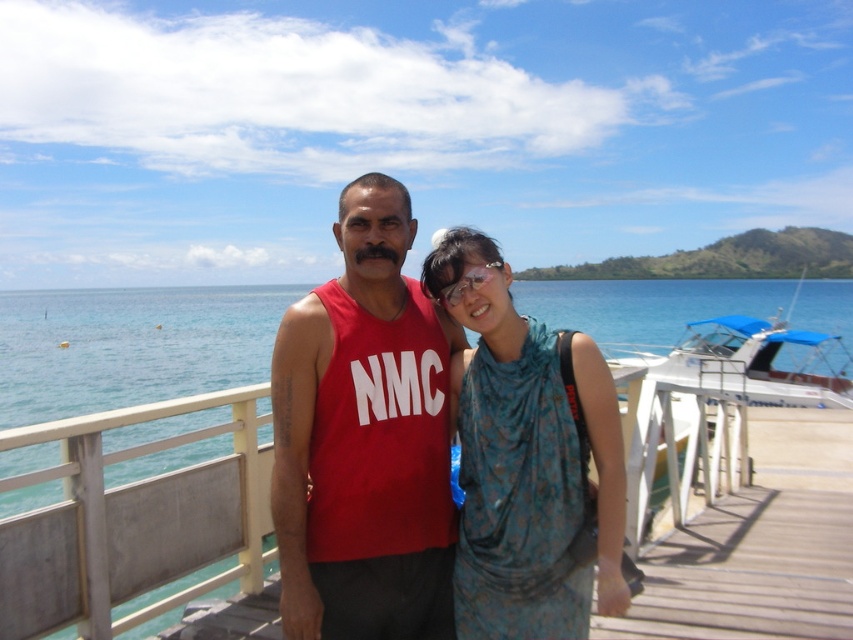
Looking at this image, who is positioned more to the left, matte red tank top at center or blue water at center?

Positioned to the left is matte red tank top at center.

Is matte red tank top at center to the right of blue water at center from the viewer's perspective?

No, matte red tank top at center is not to the right of blue water at center.

Does point (410, 221) lie behind point (107, 336)?

No, it is not.

Locate an element on the screen. This screenshot has width=853, height=640. matte red tank top at center is located at coordinates (364, 438).

Can you confirm if blue water at center is positioned above blue floral dress at center?

Yes.

Who is more forward, [752,308] or [564,589]?

Point [564,589] is in front.

Image resolution: width=853 pixels, height=640 pixels. In order to click on blue water at center in this screenshot , I will do `click(129, 346)`.

Is point (416, 490) positioned before point (521, 419)?

No, (416, 490) is behind (521, 419).

Between point (375, 529) and point (587, 420), which one is positioned in front?

Point (587, 420) is more forward.

This screenshot has height=640, width=853. What are the coordinates of `matte red tank top at center` in the screenshot? It's located at (364, 438).